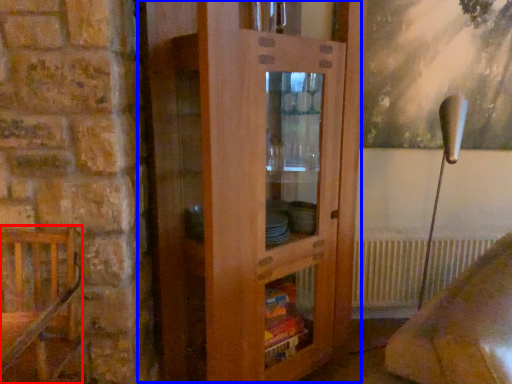
Question: Which object appears closest to the camera in this image, furniture (highlighted by a red box) or dresser (highlighted by a blue box)?

Choices:
 (A) furniture
 (B) dresser

Answer: (A)